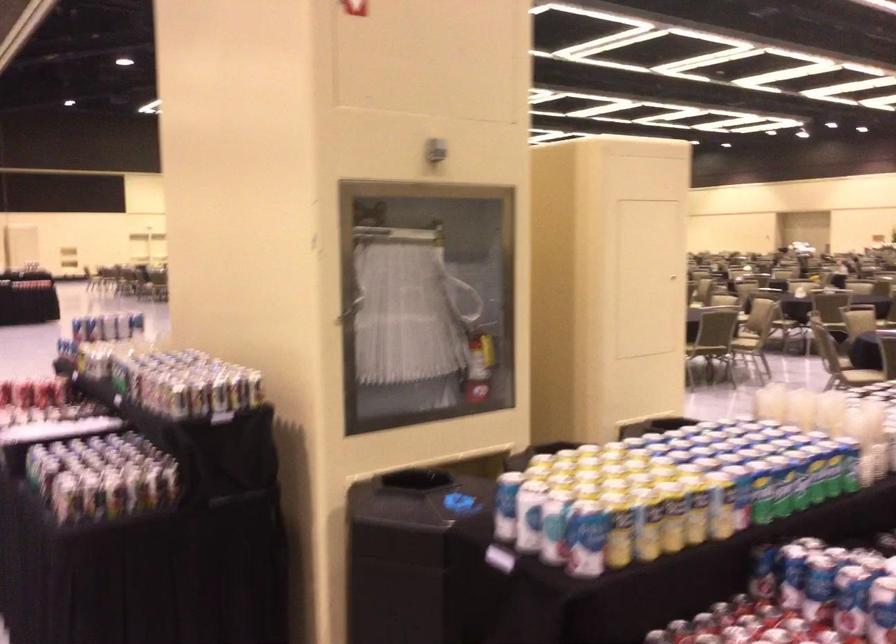
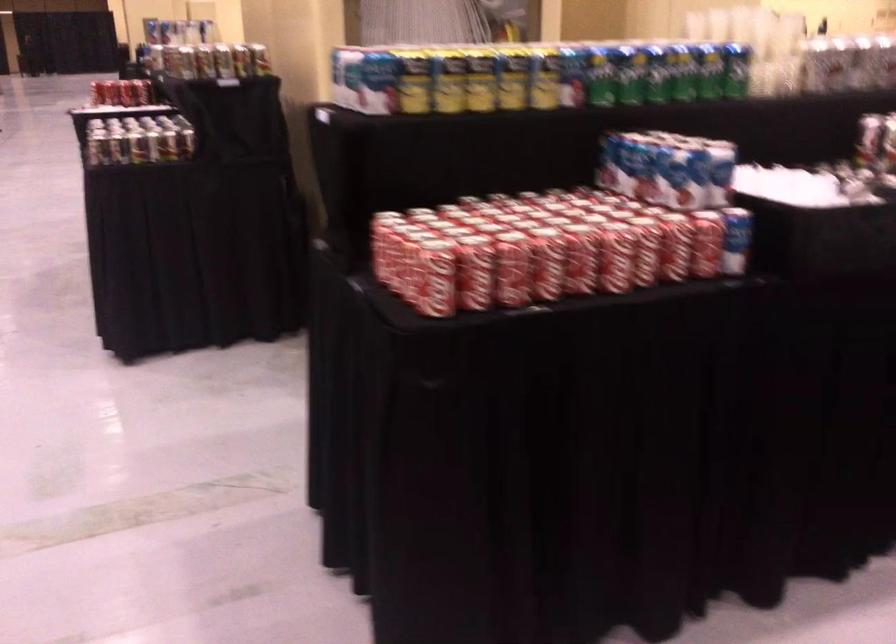
Question: Which direction would the cameraman need to move to produce the second image? Reply with the corresponding letter.

Choices:
 (A) Left
 (B) Right
 (C) Forward
 (D) Backward

Answer: (B)